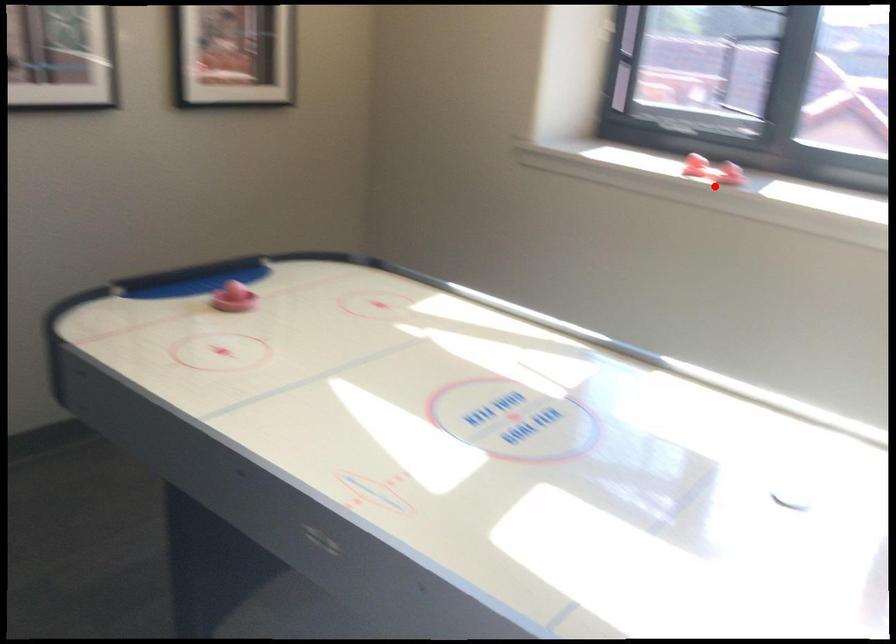
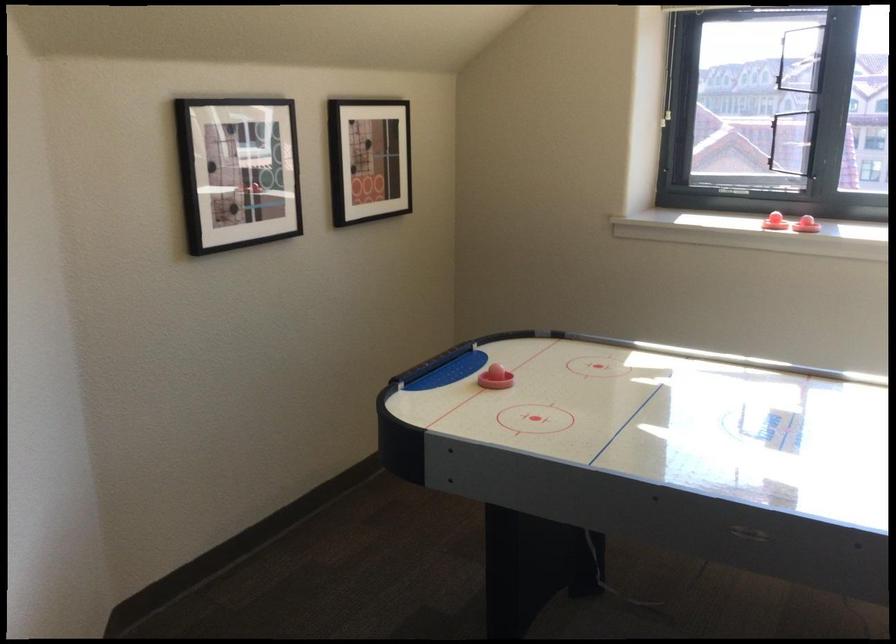
Question: I am providing you with two images of the same scene from different viewpoints. Image1 has a red point marked. In image2, the corresponding 3D location appears at what relative position? Reply with the corresponding letter.

Choices:
 (A) Closer
 (B) Farther

Answer: (B)